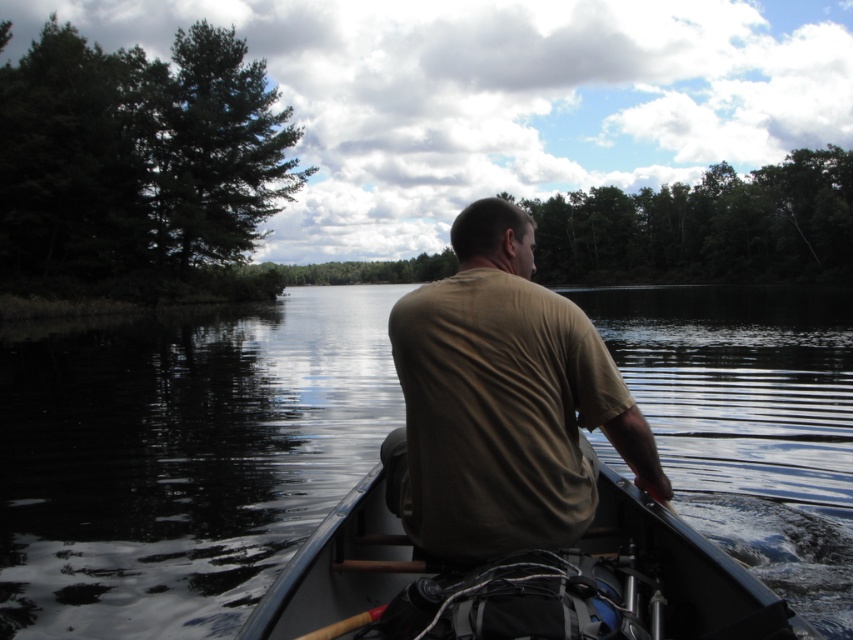
You are a photographer planning to take a photo of the tan cotton shirt at center and the gray plastic canoe at center. Which object should you focus on first if you want to ensure both are in focus without adjusting the camera settings?

You should focus on the tan cotton shirt at center first because it is closer to you than the gray plastic canoe at center, so focusing on the closer object ensures both will be in focus with proper depth of field.

You are a drone operator trying to capture a photo of the tan cotton shirt at center while avoiding the black water at center. Given that your drone can only hover 20 meters away from the shirt, will it be able to stay above the shirt without getting too close to the water?

The black water at center and tan cotton shirt at center are 21.31 meters apart from each other. Since the drone can only hover 20 meters away, it cannot stay above the shirt without getting too close to the water.